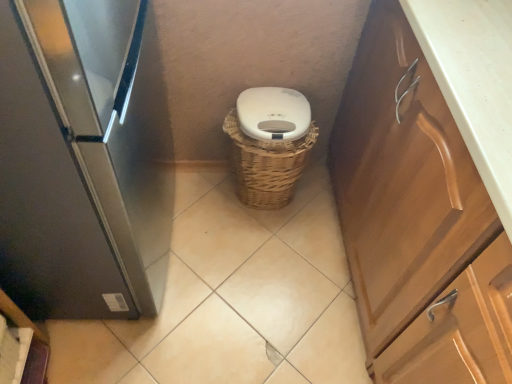
Image resolution: width=512 pixels, height=384 pixels. Find the location of `free location to the right of woven brown basket at center`. free location to the right of woven brown basket at center is located at coordinates (318, 212).